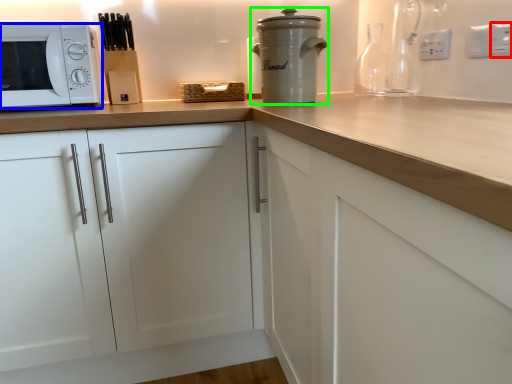
Question: Based on their relative distances, which object is nearer to electric outlet (highlighted by a red box)? Choose from microwave oven (highlighted by a blue box) and home appliance (highlighted by a green box).

Choices:
 (A) microwave oven
 (B) home appliance

Answer: (B)